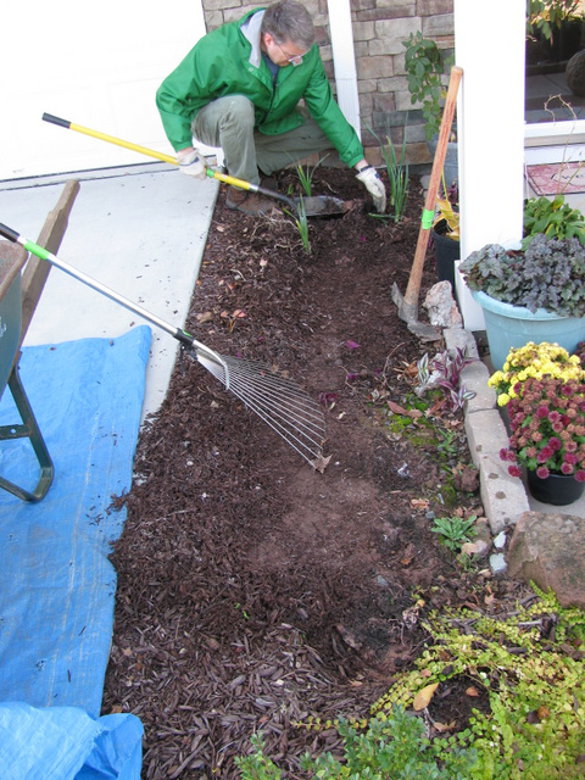
This screenshot has height=780, width=585. I want to click on welcome mat, so click(x=550, y=176).